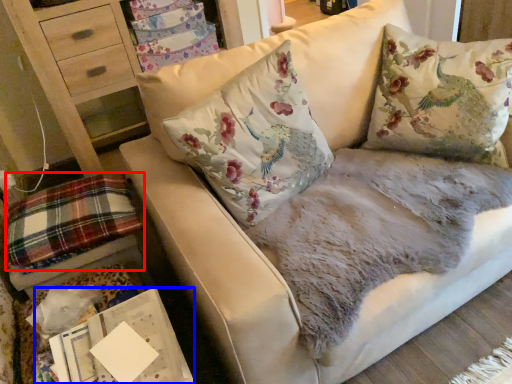
Question: Which of the following is the farthest to the observer, plaid (highlighted by a red box) or magazine (highlighted by a blue box)?

Choices:
 (A) plaid
 (B) magazine

Answer: (A)